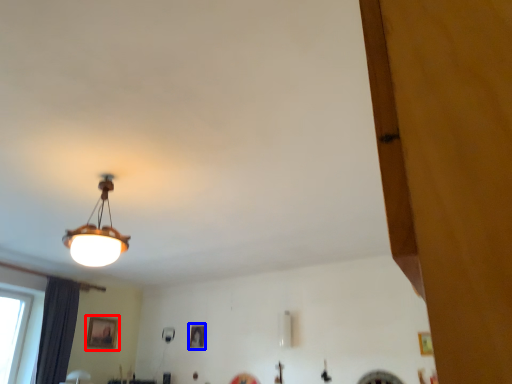
Question: Among these objects, which one is farthest to the camera, picture frame (highlighted by a red box) or picture frame (highlighted by a blue box)?

Choices:
 (A) picture frame
 (B) picture frame

Answer: (B)